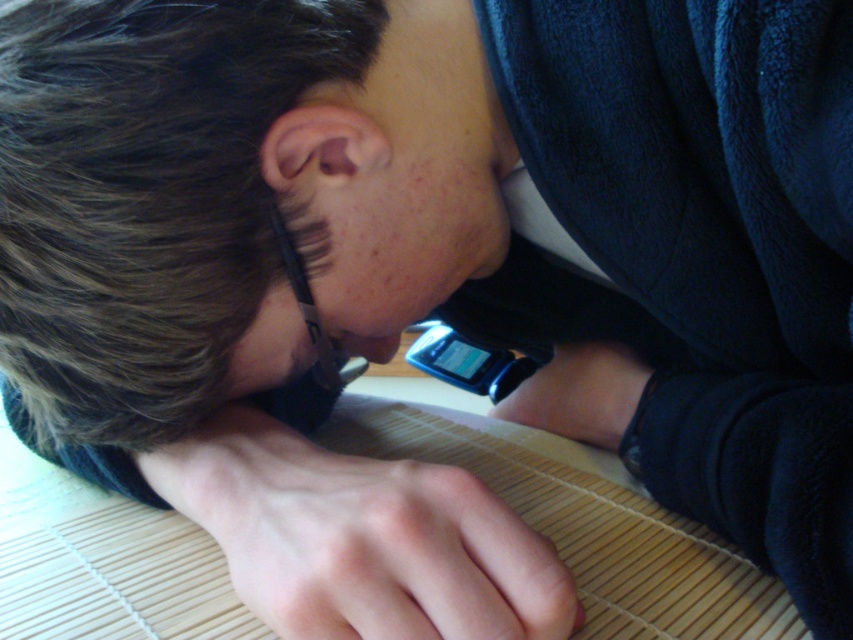
Question: Which object is farther from the camera taking this photo?

Choices:
 (A) dark blue fleece sweatshirt at upper right
 (B) satin black watch at lower center

Answer: (B)

Question: Which object appears farthest from the camera in this image?

Choices:
 (A) satin black watch at lower center
 (B) smooth skin hand at lower center
 (C) dark blue fleece sweatshirt at upper right

Answer: (A)

Question: Is smooth skin hand at lower center positioned in front of satin black watch at lower center?

Choices:
 (A) yes
 (B) no

Answer: (A)

Question: Does smooth skin hand at lower center appear on the right side of satin black watch at lower center?

Choices:
 (A) no
 (B) yes

Answer: (A)

Question: Does dark blue fleece sweatshirt at upper right have a smaller size compared to satin black watch at lower center?

Choices:
 (A) yes
 (B) no

Answer: (B)

Question: Which point appears farthest from the camera in this image?

Choices:
 (A) pyautogui.click(x=360, y=509)
 (B) pyautogui.click(x=827, y=150)

Answer: (A)